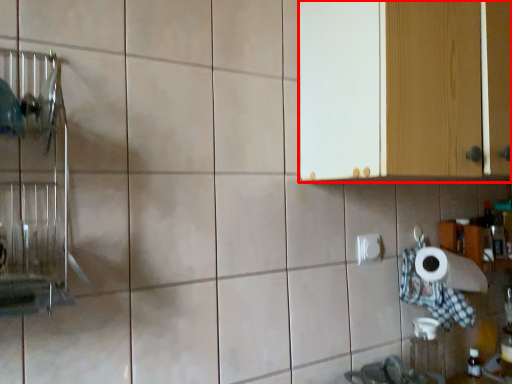
Question: From the image's perspective, where is cabinetry (annotated by the red box) located in relation to toilet paper in the image?

Choices:
 (A) above
 (B) below

Answer: (A)